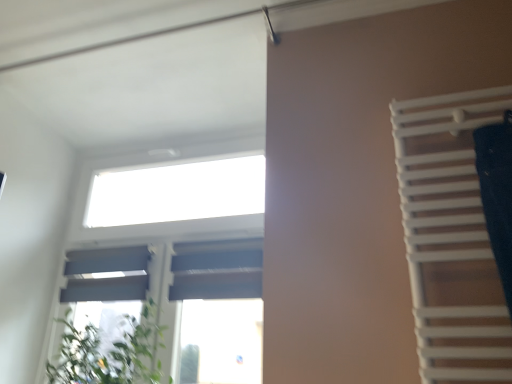
The width and height of the screenshot is (512, 384). In order to click on white matte window at upper center in this screenshot , I will do `click(173, 253)`.

Describe the element at coordinates (173, 253) in the screenshot. I see `white matte window at upper center` at that location.

Where is `white matte window at upper center`? white matte window at upper center is located at coordinates point(173,253).